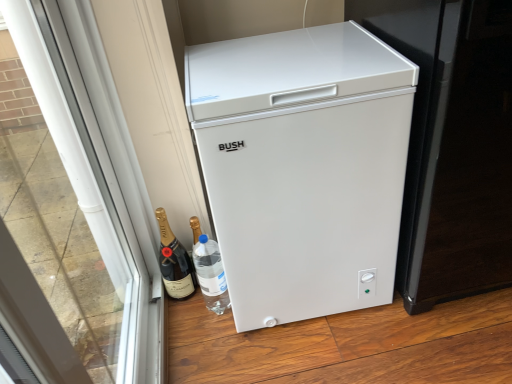
Identify the location of white plastic freezer at right. (461, 161).

Image resolution: width=512 pixels, height=384 pixels. In order to click on glass door located on the left of black glass bottle at lower left in this screenshot , I will do `click(75, 216)`.

Considering the relative positions of black glass bottle at lower left and transparent glass door at left in the image provided, is black glass bottle at lower left to the left of transparent glass door at left from the viewer's perspective?

In fact, black glass bottle at lower left is to the right of transparent glass door at left.

In the scene shown: Considering the sizes of objects white plastic freezer at right and black glass bottle at lower left in the image provided, who is bigger, white plastic freezer at right or black glass bottle at lower left?

Bigger between the two is white plastic freezer at right.

Considering the sizes of objects white plastic freezer at right and black glass bottle at lower left in the image provided, who is taller, white plastic freezer at right or black glass bottle at lower left?

white plastic freezer at right is taller.

What's the angular difference between white plastic freezer at right and black glass bottle at lower left's facing directions?

The angle between the facing direction of white plastic freezer at right and the facing direction of black glass bottle at lower left is 5.23 degrees.

Is white plastic freezer at right facing away from black glass bottle at lower left?

No, black glass bottle at lower left is not at the back of white plastic freezer at right.

Which is more to the left, white matte refrigerator at center or black glass bottle at lower left?

black glass bottle at lower left is more to the left.

Does white matte refrigerator at center come behind black glass bottle at lower left?

No, the depth of white matte refrigerator at center is less than that of black glass bottle at lower left.

This screenshot has height=384, width=512. In order to click on wine behind the white matte refrigerator at center in this screenshot , I will do `click(174, 262)`.

Is the surface of white matte refrigerator at center in direct contact with black glass bottle at lower left?

They are not placed beside each other.

Would you consider white plastic freezer at right to be distant from transparent glass door at left?

white plastic freezer at right is far away from transparent glass door at left.

Between white plastic freezer at right and transparent glass door at left, which one has larger width?

white plastic freezer at right is wider.

Which is closer, (477, 35) or (136, 211)?

Point (477, 35).

Is the depth of white plastic freezer at right less than that of transparent glass door at left?

No, white plastic freezer at right is further to the viewer.

Considering the relative positions of black glass bottle at lower left and white matte refrigerator at center in the image provided, is black glass bottle at lower left to the right of white matte refrigerator at center from the viewer's perspective?

Incorrect, black glass bottle at lower left is not on the right side of white matte refrigerator at center.

From the image's perspective, is black glass bottle at lower left on top of white matte refrigerator at center?

No, from the image's perspective, black glass bottle at lower left is not over white matte refrigerator at center.

How different are the orientations of black glass bottle at lower left and white matte refrigerator at center in degrees?

5.44 degrees.

Is black glass bottle at lower left facing away from white matte refrigerator at center?

black glass bottle at lower left is not turned away from white matte refrigerator at center.

From the picture: Would you consider transparent glass door at left to be distant from black glass bottle at lower left?

Actually, transparent glass door at left and black glass bottle at lower left are a little close together.

Based on the photo, could you tell me if transparent glass door at left is facing black glass bottle at lower left?

Yes, transparent glass door at left is turned towards black glass bottle at lower left.

Is transparent glass door at left to the left of black glass bottle at lower left from the viewer's perspective?

Yes, transparent glass door at left is to the left of black glass bottle at lower left.

Is white matte refrigerator at center positioned with its back to transparent glass door at left?

No.

Is white matte refrigerator at center beside transparent glass door at left?

They are not placed beside each other.

The image size is (512, 384). Find the location of `refrigerator below the transparent glass door at left (from a real-world perspective)`. refrigerator below the transparent glass door at left (from a real-world perspective) is located at coordinates (303, 167).

From the image's perspective, would you say white matte refrigerator at center is shown under transparent glass door at left?

No, from the image's perspective, white matte refrigerator at center is not beneath transparent glass door at left.

Where is `glass door above the black glass bottle at lower left (from the image's perspective)`? The image size is (512, 384). glass door above the black glass bottle at lower left (from the image's perspective) is located at coordinates (75, 216).

You are a GUI agent. You are given a task and a screenshot of the screen. Output one action in this format:
    pyautogui.click(x=<x>, y=<y>)
    Task: Click on the screen door in front of the black glass bottle at lower left
    This screenshot has width=512, height=384.
    Given the screenshot: What is the action you would take?
    pyautogui.click(x=461, y=161)

Considering their positions, is transparent glass door at left positioned further to white plastic freezer at right than black glass bottle at lower left?

The object further to white plastic freezer at right is transparent glass door at left.

Considering their positions, is black glass bottle at lower left positioned further to transparent glass door at left than white matte refrigerator at center?

The object further to transparent glass door at left is white matte refrigerator at center.

Estimate the real-world distances between objects in this image. Which object is further from transparent glass door at left, white matte refrigerator at center or black glass bottle at lower left?

white matte refrigerator at center lies further to transparent glass door at left than the other object.

Estimate the real-world distances between objects in this image. Which object is further from white plastic freezer at right, white matte refrigerator at center or black glass bottle at lower left?

Among the two, black glass bottle at lower left is located further to white plastic freezer at right.

Looking at this image, which object lies nearer to the anchor point black glass bottle at lower left, white plastic freezer at right or transparent glass door at left?

The object closer to black glass bottle at lower left is transparent glass door at left.

Which object lies further to the anchor point white matte refrigerator at center, white plastic freezer at right or black glass bottle at lower left?

black glass bottle at lower left is further to white matte refrigerator at center.

Considering their positions, is transparent glass door at left positioned further to white matte refrigerator at center than white plastic freezer at right?

transparent glass door at left lies further to white matte refrigerator at center than the other object.

From the image, which object appears to be farther from transparent glass door at left, white plastic freezer at right or black glass bottle at lower left?

white plastic freezer at right.

The height and width of the screenshot is (384, 512). What are the coordinates of `refrigerator between transparent glass door at left and white plastic freezer at right in the horizontal direction` in the screenshot? It's located at coord(303,167).

Locate an element on the screen. The height and width of the screenshot is (384, 512). wine between transparent glass door at left and white plastic freezer at right in the horizontal direction is located at coordinates (174, 262).

I want to click on refrigerator between black glass bottle at lower left and white plastic freezer at right in the horizontal direction, so click(303, 167).

Locate an element on the screen. This screenshot has height=384, width=512. refrigerator located between transparent glass door at left and black glass bottle at lower left in the depth direction is located at coordinates (303, 167).